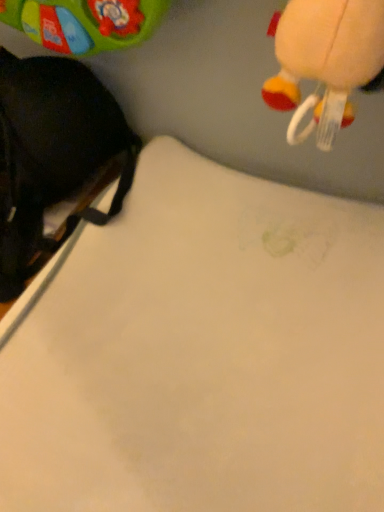
Question: Does black fabric backpack at left have a larger size compared to white matte sheet at center?

Choices:
 (A) yes
 (B) no

Answer: (B)

Question: Is black fabric backpack at left oriented away from white matte sheet at center?

Choices:
 (A) no
 (B) yes

Answer: (A)

Question: Is black fabric backpack at left behind white matte sheet at center?

Choices:
 (A) yes
 (B) no

Answer: (A)

Question: Considering the relative sizes of black fabric backpack at left and white matte sheet at center in the image provided, is black fabric backpack at left shorter than white matte sheet at center?

Choices:
 (A) yes
 (B) no

Answer: (B)

Question: Would you say black fabric backpack at left contains white matte sheet at center?

Choices:
 (A) yes
 (B) no

Answer: (B)

Question: Is there a large distance between black fabric backpack at left and white matte sheet at center?

Choices:
 (A) no
 (B) yes

Answer: (A)

Question: Is the surface of white matte sheet at center in direct contact with black fabric backpack at left?

Choices:
 (A) no
 (B) yes

Answer: (A)

Question: Is white matte sheet at center taller than black fabric backpack at left?

Choices:
 (A) yes
 (B) no

Answer: (B)

Question: Is white matte sheet at center aimed at black fabric backpack at left?

Choices:
 (A) no
 (B) yes

Answer: (A)

Question: Is the depth of white matte sheet at center less than that of black fabric backpack at left?

Choices:
 (A) no
 (B) yes

Answer: (B)

Question: From the image's perspective, is white matte sheet at center under black fabric backpack at left?

Choices:
 (A) yes
 (B) no

Answer: (A)

Question: Would you say white matte sheet at center contains black fabric backpack at left?

Choices:
 (A) no
 (B) yes

Answer: (A)

Question: Would you say white matte sheet at center is to the left or to the right of black fabric backpack at left in the picture?

Choices:
 (A) right
 (B) left

Answer: (A)